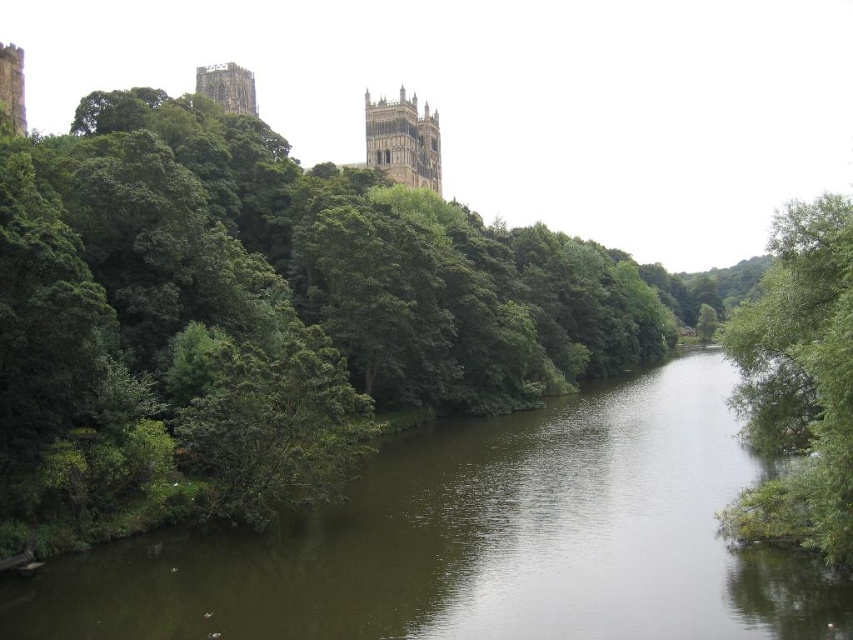
You are an artist planning to sketch this riverside scene. You want to ensure the green leafy tree at right and the stone tower at upper left are proportionally accurate. Which object should you draw larger in your sketch?

The green leafy tree at right should be drawn larger than the stone tower at upper left because it is bigger in the image.

You are an architect analyzing the riverside scene. You notice the brown stone tower at upper center and the stone tower at upper left. Which tower has a larger structure?

The stone tower at upper left is larger than the brown stone tower at upper center.